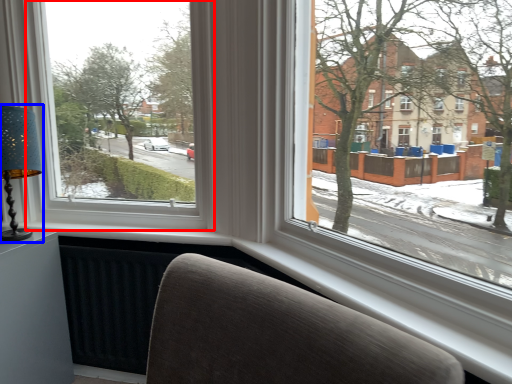
Question: Which object is further to the camera taking this photo, window (highlighted by a red box) or table lamp (highlighted by a blue box)?

Choices:
 (A) window
 (B) table lamp

Answer: (B)